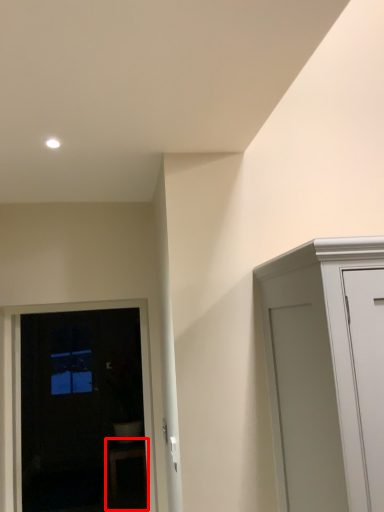
Question: From the image, what is the correct spatial relationship of furniture (annotated by the red box) in relation to door?

Choices:
 (A) left
 (B) right

Answer: (B)